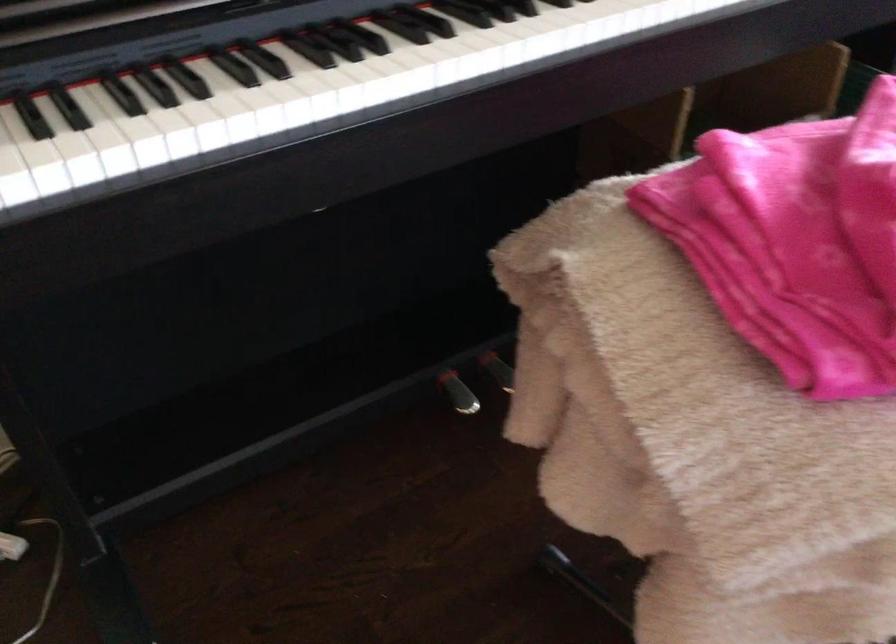
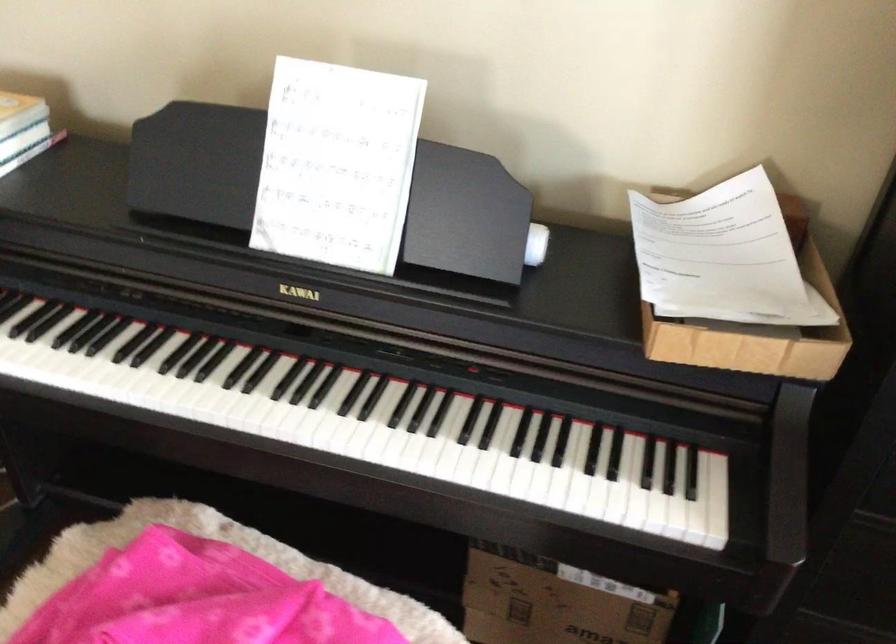
Locate, in the second image, the point that corresponds to the point at 385,67 in the first image.

(58, 368)